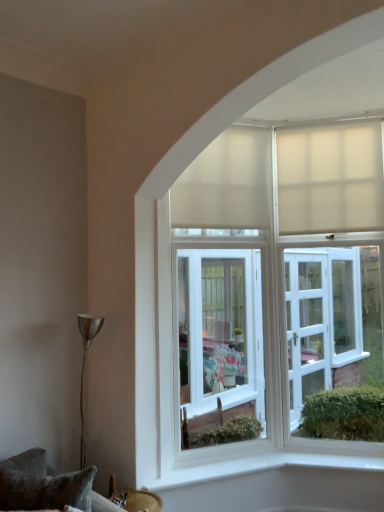
Question: Based on their sizes in the image, would you say beige matte curtain at upper right, which is the first curtain from right to left, is bigger or smaller than white matte curtain at upper center, which is the first curtain from left to right?

Choices:
 (A) small
 (B) big

Answer: (A)

Question: Is beige matte curtain at upper right, which is the first curtain from right to left, taller or shorter than white matte curtain at upper center, which is the 2th curtain in right-to-left order?

Choices:
 (A) tall
 (B) short

Answer: (B)

Question: Considering the real-world distances, which object is farthest from the white matte curtain at upper center, which is the 2th curtain in right-to-left order?

Choices:
 (A) beige matte curtain at upper right, the second curtain viewed from the left
 (B) velvet cushion at lower left

Answer: (B)

Question: Estimate the real-world distances between objects in this image. Which object is farther from the white matte curtain at upper center, which is the first curtain from left to right?

Choices:
 (A) beige matte curtain at upper right, the second curtain viewed from the left
 (B) velvet cushion at lower left

Answer: (B)